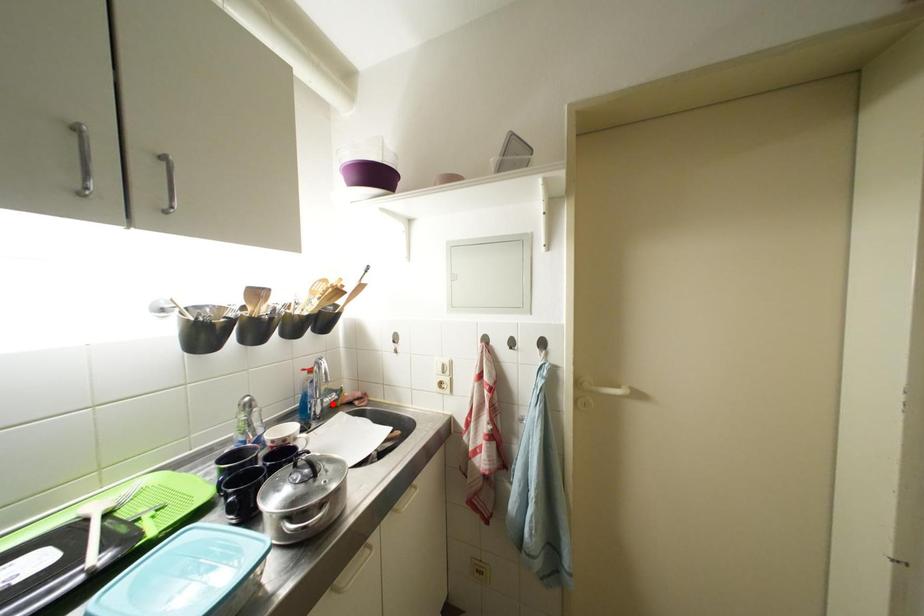
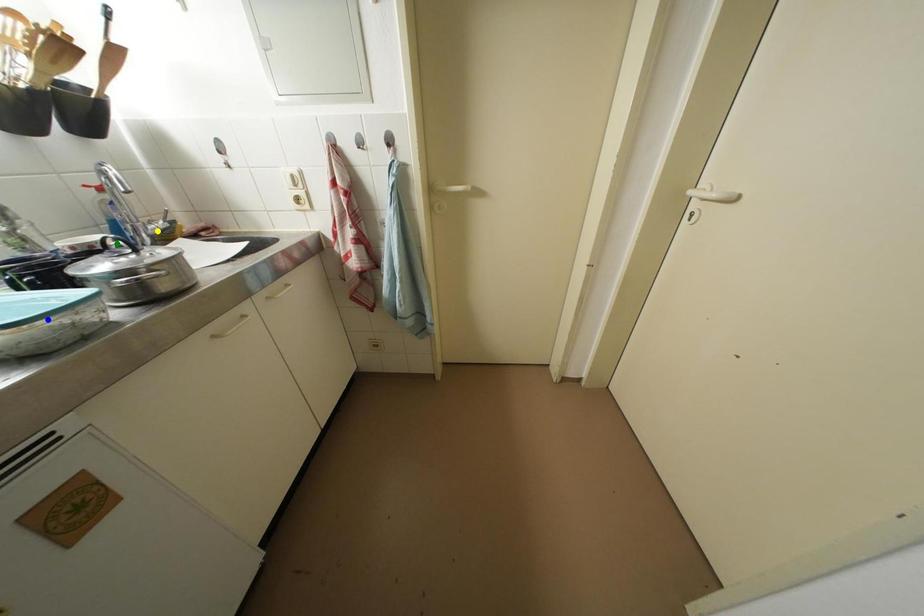
Question: I am providing you with two images of the same scene from different viewpoints. A red point is marked on the first image. You are given multiple points on the second image. Which point in image 2 represents the same 3d spot as the red point in image 1?

Choices:
 (A) green point
 (B) blue point
 (C) yellow point

Answer: (C)